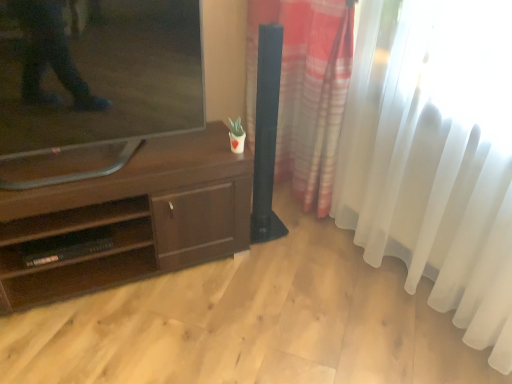
Where is `vacant area that is in front of translucent fabric curtain at right`? vacant area that is in front of translucent fabric curtain at right is located at coordinates [x=326, y=314].